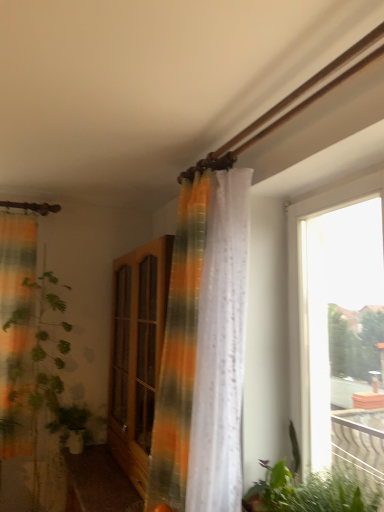
Question: Looking at the image, does wooden cabinet at center seem bigger or smaller compared to wooden cabinet at center?

Choices:
 (A) small
 (B) big

Answer: (B)

Question: Considering the positions of point (127, 300) and point (109, 505), is point (127, 300) closer or farther from the camera than point (109, 505)?

Choices:
 (A) closer
 (B) farther

Answer: (B)

Question: Estimate the real-world distances between objects in this image. Which object is closer to the green leafy plant at lower right, the second vegetation positioned from the left?

Choices:
 (A) wooden cabinet at center
 (B) green matte plant at lower left, the 2th vegetation when ordered from right to left
 (C) transparent glass window at right
 (D) wooden cabinet at center
 (E) translucent orange-green curtain at center

Answer: (C)

Question: Which object is the closest to the green matte plant at lower left, acting as the second vegetation starting from the top?

Choices:
 (A) translucent orange-green curtain at center
 (B) wooden cabinet at center
 (C) green leafy plant at lower right, the 1th vegetation viewed from the top
 (D) transparent glass window at right
 (E) wooden cabinet at center

Answer: (E)